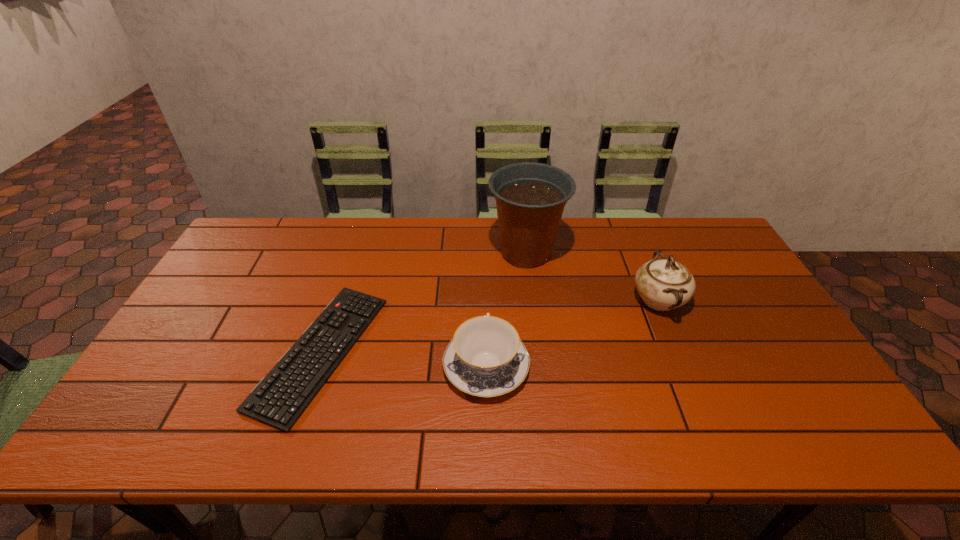
I want to click on free spot between the tallest object and the shortest object, so click(423, 302).

I want to click on vacant space that's between the leftmost object and the shorter chinaware, so click(x=403, y=359).

Find the location of a particular element. The image size is (960, 540). vacant area that lies between the flowerpot and the shorter chinaware is located at coordinates (506, 309).

Find the location of a particular element. free space between the right chinaware and the tallest object is located at coordinates (592, 276).

Locate an element on the screen. Image resolution: width=960 pixels, height=540 pixels. vacant space that's between the nearer chinaware and the shortest object is located at coordinates (403, 359).

Where is `vacant area that lies between the left chinaware and the taller chinaware`? The image size is (960, 540). vacant area that lies between the left chinaware and the taller chinaware is located at coordinates (572, 333).

In order to click on vacant space that is in between the shortest object and the tallest object in this screenshot , I will do `click(423, 302)`.

Locate an element on the screen. The height and width of the screenshot is (540, 960). free area in between the leftmost object and the nearer chinaware is located at coordinates (403, 359).

I want to click on the third closest object to the third tallest object, so click(664, 284).

Point out which object is positioned as the nearest to the tallest object. Please provide its 2D coordinates. Your answer should be formatted as a tuple, i.e. [(x, y)], where the tuple contains the x and y coordinates of a point satisfying the conditions above.

[(664, 284)]